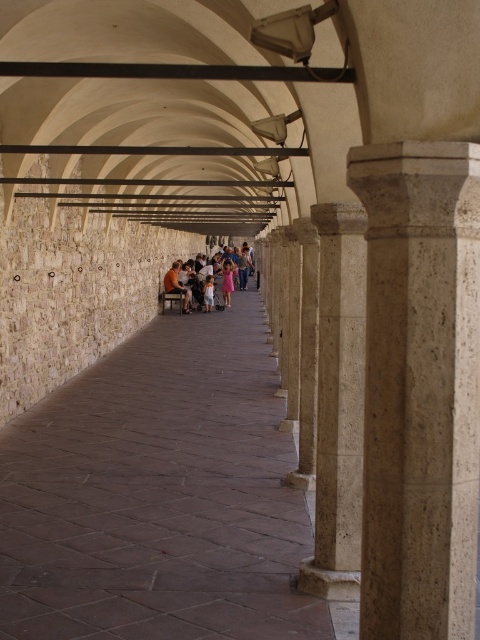
Is pink fabric dress at center smaller than brown leather jacket at center?

No, pink fabric dress at center is not smaller than brown leather jacket at center.

Is the position of pink fabric dress at center less distant than that of brown leather jacket at center?

No, pink fabric dress at center is further to the viewer.

Where is `pink fabric dress at center`? This screenshot has width=480, height=640. pink fabric dress at center is located at coordinates click(x=210, y=276).

Find the location of `pink fabric dress at center`. pink fabric dress at center is located at coordinates (210, 276).

Who is taller, brown stone path at center or pink fabric dress at center?

pink fabric dress at center is taller.

Is point (0, 618) positioned before point (188, 307)?

Yes, point (0, 618) is in front of point (188, 307).

Which is behind, point (50, 566) or point (183, 268)?

The point (183, 268) is more distant.

Image resolution: width=480 pixels, height=640 pixels. Find the location of `brown stone path at center`. brown stone path at center is located at coordinates (157, 496).

Is brown stone path at center wider than beige marble pillar at center?

Correct, the width of brown stone path at center exceeds that of beige marble pillar at center.

Does brown stone path at center come behind beige marble pillar at center?

Yes, it is.

This screenshot has height=640, width=480. What do you see at coordinates (157, 496) in the screenshot? I see `brown stone path at center` at bounding box center [157, 496].

Image resolution: width=480 pixels, height=640 pixels. I want to click on brown stone path at center, so click(157, 496).